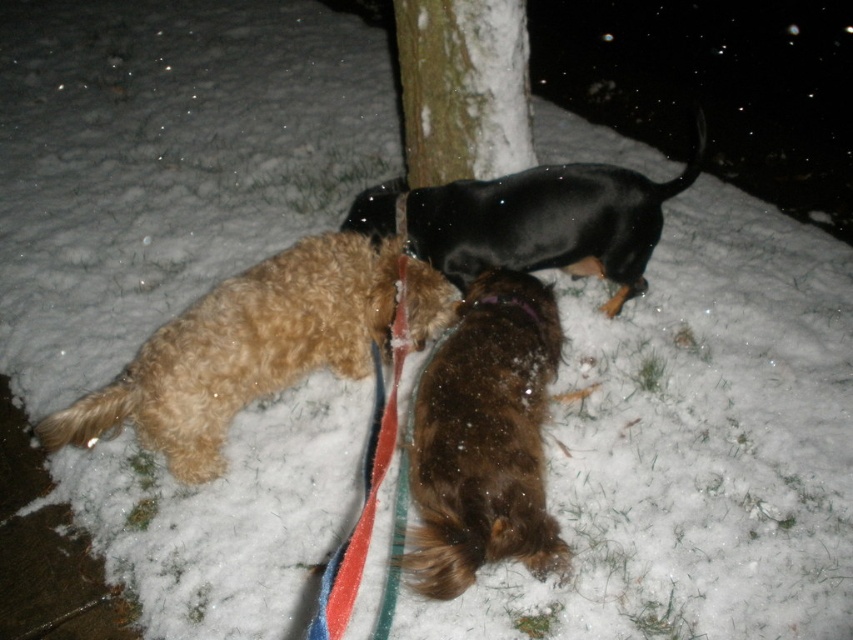
Question: Is brown fuzzy dog at center closer to camera compared to black glossy dog at center?

Choices:
 (A) no
 (B) yes

Answer: (B)

Question: Which point is farther to the camera?

Choices:
 (A) snow-covered bark at center
 (B) fuzzy brown dog at lower left

Answer: (A)

Question: Which object is farther from the camera taking this photo?

Choices:
 (A) brown fuzzy dog at center
 (B) snow-covered bark at center
 (C) black glossy dog at center
 (D) fuzzy brown dog at lower left

Answer: (B)

Question: Can you confirm if brown fuzzy dog at center is smaller than snow-covered bark at center?

Choices:
 (A) no
 (B) yes

Answer: (A)

Question: Can you confirm if brown fuzzy dog at center is positioned to the right of black glossy dog at center?

Choices:
 (A) no
 (B) yes

Answer: (A)

Question: Which point is closer to the camera?

Choices:
 (A) (512, 369)
 (B) (190, 481)
 (C) (473, 132)

Answer: (A)